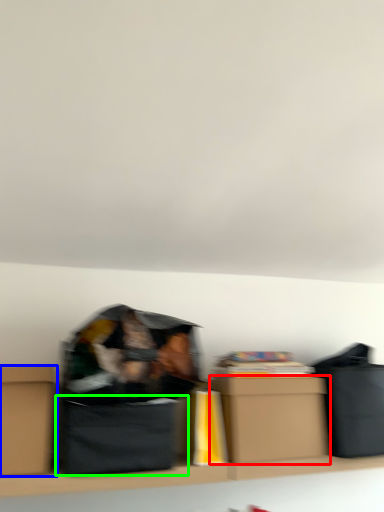
Question: Which object is positioned closest to box (highlighted by a red box)? Select from box (highlighted by a blue box) and cardboard box (highlighted by a green box).

Choices:
 (A) box
 (B) cardboard box

Answer: (B)